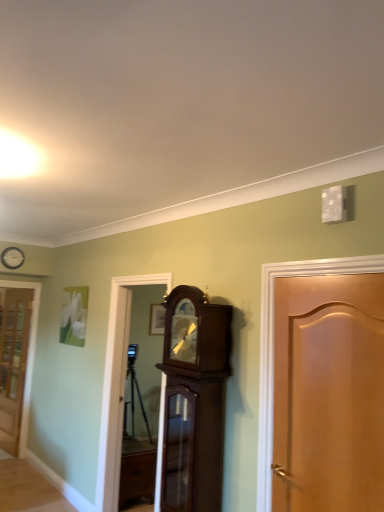
Find the location of a particular element. The height and width of the screenshot is (512, 384). vacant point above wooden door at right, the 2th door when ordered from left to right (from a real-world perspective) is located at coordinates (326, 276).